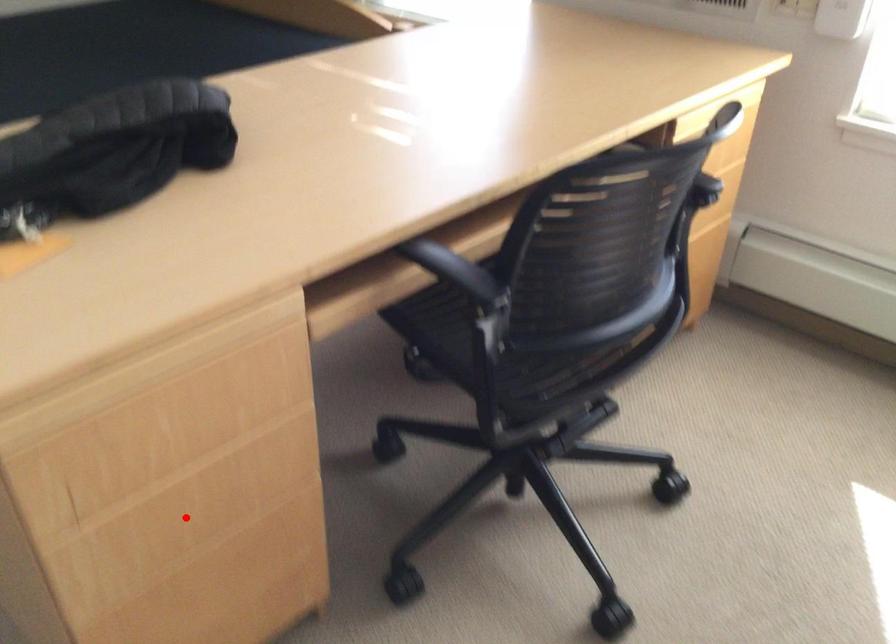
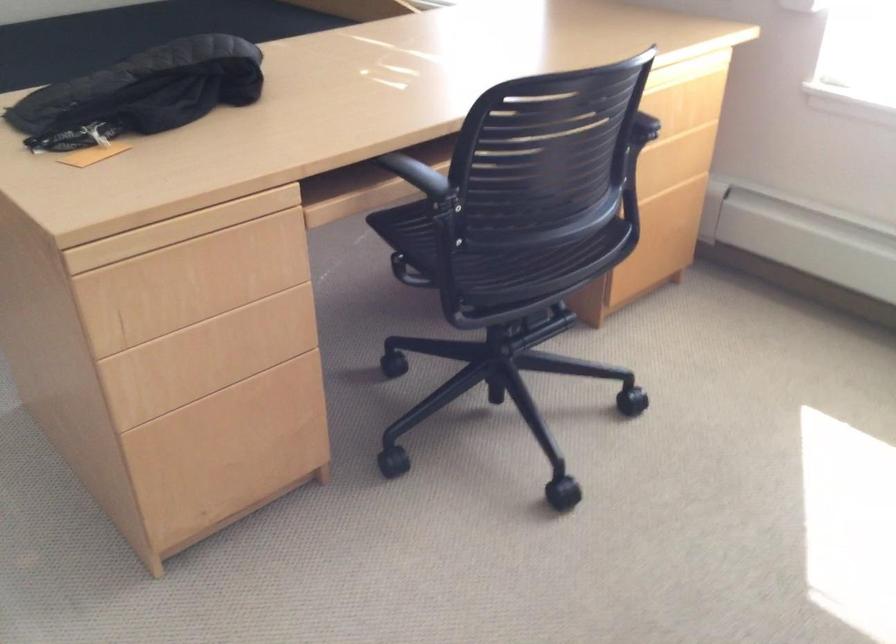
Question: A red point is marked in image1. In image2, is the corresponding 3D point closer to the camera or farther? Reply with the corresponding letter.

Choices:
 (A) The corresponding 3D point is closer.
 (B) The corresponding 3D point is farther.

Answer: (B)